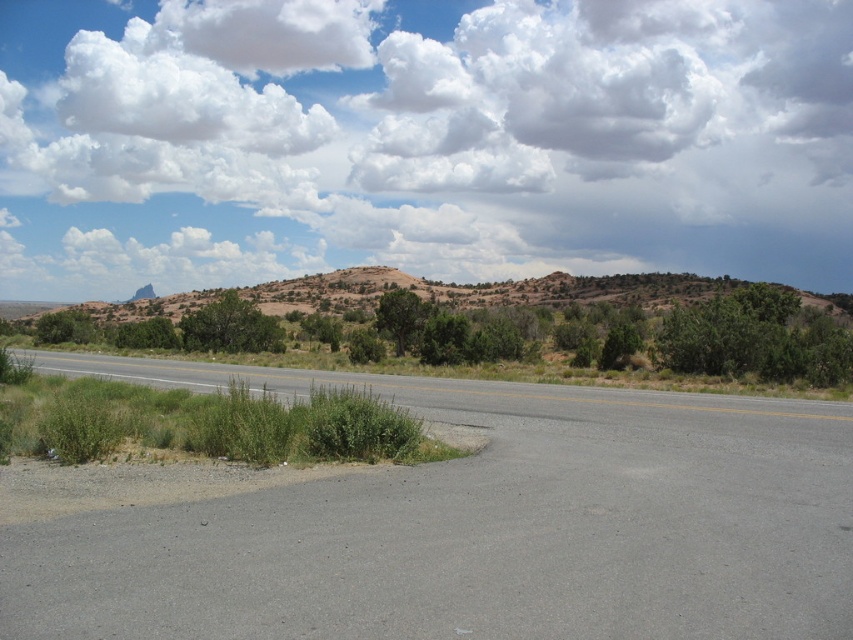
Question: Which object is closer to the camera taking this photo?

Choices:
 (A) white fluffy cloud at upper center
 (B) gray asphalt highway at center
 (C) brown/dry grassy hill at center

Answer: (B)

Question: Which point is farther to the camera?

Choices:
 (A) (412, 24)
 (B) (810, 445)
 (C) (276, 324)

Answer: (A)

Question: Does white fluffy cloud at upper center have a greater width compared to gray asphalt highway at center?

Choices:
 (A) yes
 (B) no

Answer: (A)

Question: Is gray asphalt highway at center above brown/dry grassy hill at center?

Choices:
 (A) no
 (B) yes

Answer: (A)

Question: Considering the real-world distances, which object is closest to the gray asphalt highway at center?

Choices:
 (A) brown/dry grassy hill at center
 (B) white fluffy cloud at upper center

Answer: (A)

Question: Is the position of white fluffy cloud at upper center less distant than that of brown/dry grassy hill at center?

Choices:
 (A) no
 (B) yes

Answer: (A)